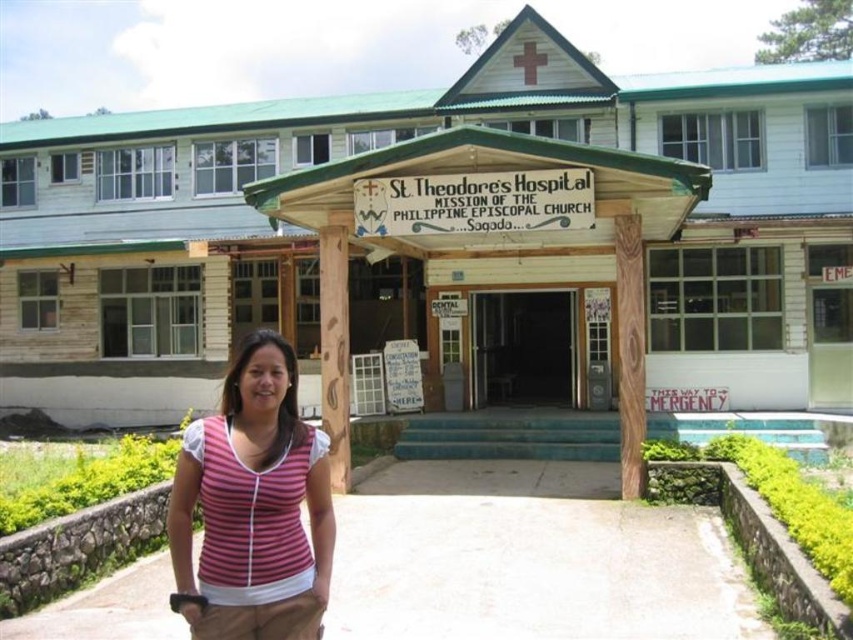
Does pink striped shirt at lower left have a greater height compared to wooden column at center?

No.

Does pink striped shirt at lower left come behind wooden column at center?

No, pink striped shirt at lower left is closer to the viewer.

Is point (216, 460) positioned after point (329, 317)?

That is False.

I want to click on pink striped shirt at lower left, so click(x=254, y=506).